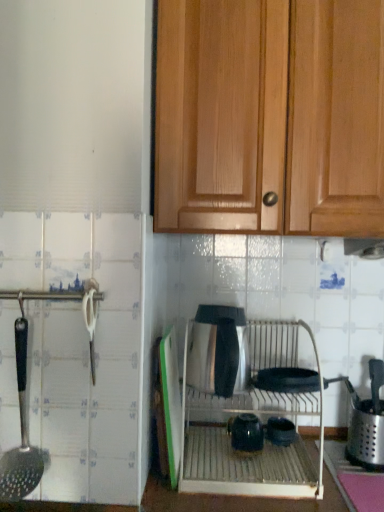
Question: Is the depth of glossy ceramic tea pot at center less than that of satin silver kettle at center, the 3th appliance when ordered from right to left?

Choices:
 (A) no
 (B) yes

Answer: (A)

Question: Is satin silver kettle at center, the first appliance from the left, at the back of glossy ceramic tea pot at center?

Choices:
 (A) no
 (B) yes

Answer: (A)

Question: From a real-world perspective, does glossy ceramic tea pot at center stand above satin silver kettle at center, the 3th appliance when ordered from right to left?

Choices:
 (A) no
 (B) yes

Answer: (A)

Question: Does glossy ceramic tea pot at center have a greater width compared to satin silver kettle at center, the 3th appliance when ordered from right to left?

Choices:
 (A) yes
 (B) no

Answer: (B)

Question: From the image's perspective, is glossy ceramic tea pot at center located beneath satin silver kettle at center, the first appliance from the left?

Choices:
 (A) no
 (B) yes

Answer: (B)

Question: From a real-world perspective, is satin silver exhaust hood at upper center physically located above or below wooden cabinet at upper center?

Choices:
 (A) below
 (B) above

Answer: (A)

Question: Does point (354, 241) appear closer or farther from the camera than point (253, 209)?

Choices:
 (A) closer
 (B) farther

Answer: (B)

Question: Is satin silver exhaust hood at upper center wider or thinner than wooden cabinet at upper center?

Choices:
 (A) thin
 (B) wide

Answer: (A)

Question: Considering their positions, is satin silver exhaust hood at upper center located in front of or behind wooden cabinet at upper center?

Choices:
 (A) front
 (B) behind

Answer: (B)

Question: From the image's perspective, is satin silver kettle at center, the 3th appliance when ordered from right to left, positioned above or below black plastic slotted spoon at left?

Choices:
 (A) below
 (B) above

Answer: (B)

Question: In terms of height, does satin silver kettle at center, the 3th appliance when ordered from right to left, look taller or shorter compared to black plastic slotted spoon at left?

Choices:
 (A) short
 (B) tall

Answer: (A)

Question: Is point (243, 337) positioned closer to the camera than point (19, 354)?

Choices:
 (A) closer
 (B) farther

Answer: (B)

Question: Which is correct: satin silver kettle at center, the first appliance from the left, is inside black plastic slotted spoon at left, or outside of it?

Choices:
 (A) outside
 (B) inside

Answer: (A)

Question: Considering the positions of satin silver oven at center and black plastic slotted spoon at left in the image, is satin silver oven at center wider or thinner than black plastic slotted spoon at left?

Choices:
 (A) wide
 (B) thin

Answer: (A)

Question: Is satin silver oven at center bigger or smaller than black plastic slotted spoon at left?

Choices:
 (A) big
 (B) small

Answer: (A)